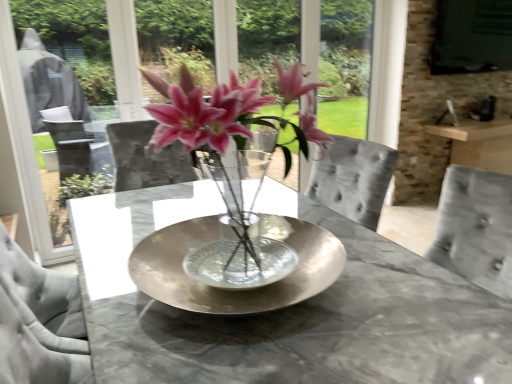
Question: From a real-world perspective, is black matte window screen at upper right above or below metallic silver bowl at center?

Choices:
 (A) above
 (B) below

Answer: (A)

Question: In the image, is black matte window screen at upper right on the left side or the right side of metallic silver bowl at center?

Choices:
 (A) right
 (B) left

Answer: (A)

Question: Considering the real-world distances, which object is closest to the black matte window screen at upper right?

Choices:
 (A) metallic silver bowl at center
 (B) pink glass vase at center

Answer: (B)

Question: Which of these objects is positioned closest to the black matte window screen at upper right?

Choices:
 (A) pink glass vase at center
 (B) metallic silver bowl at center

Answer: (A)